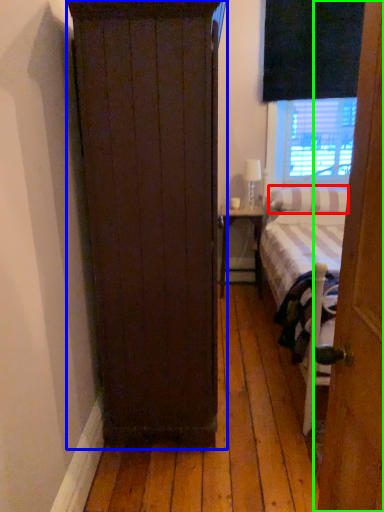
Question: Considering the real-world distances, which object is closest to pillow (highlighted by a red box)? cupboard (highlighted by a blue box) or door (highlighted by a green box).

Choices:
 (A) cupboard
 (B) door

Answer: (A)